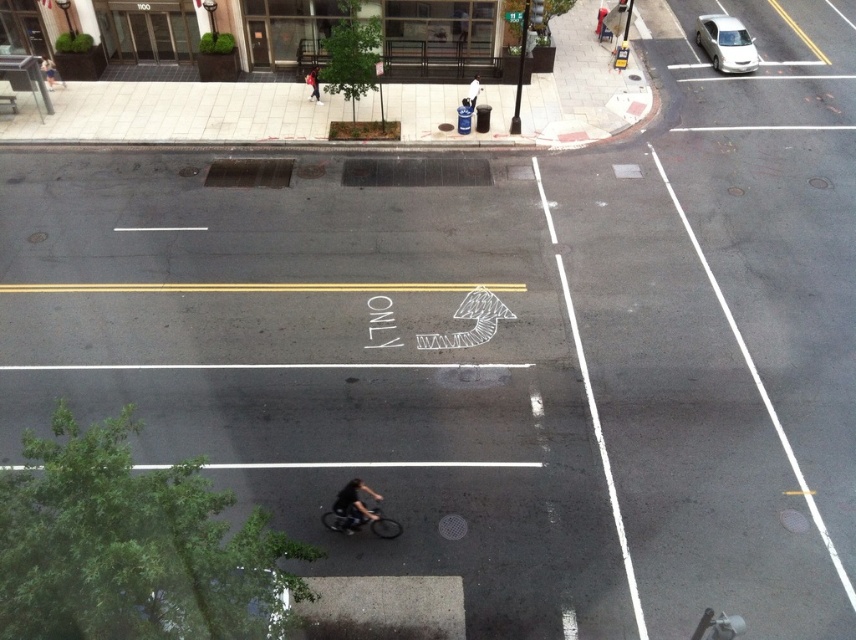
Does silver metallic car at upper right appear under dark blue jeans at center?

No.

Does silver metallic car at upper right appear on the left side of dark blue jeans at center?

In fact, silver metallic car at upper right is to the right of dark blue jeans at center.

Which is behind, point (721, 33) or point (313, 80)?

Positioned behind is point (721, 33).

Locate an element on the screen. The image size is (856, 640). silver metallic car at upper right is located at coordinates (726, 44).

What do you see at coordinates (361, 522) in the screenshot? I see `black matte bicycle at lower center` at bounding box center [361, 522].

Can you confirm if black matte bicycle at lower center is smaller than dark blue jeans at center?

Incorrect, black matte bicycle at lower center is not smaller in size than dark blue jeans at center.

You are a GUI agent. You are given a task and a screenshot of the screen. Output one action in this format:
    pyautogui.click(x=<x>, y=<y>)
    Task: Click on the black matte bicycle at lower center
    This screenshot has width=856, height=640.
    Given the screenshot: What is the action you would take?
    coord(361,522)

Find the location of a particular element. black matte bicycle at lower center is located at coordinates (361, 522).

Is point (699, 36) farther from viewer compared to point (369, 518)?

Yes, point (699, 36) is behind point (369, 518).

Does point (718, 67) come farther from viewer compared to point (352, 502)?

Yes, it is behind point (352, 502).

Locate an element on the screen. silver metallic car at upper right is located at coordinates (726, 44).